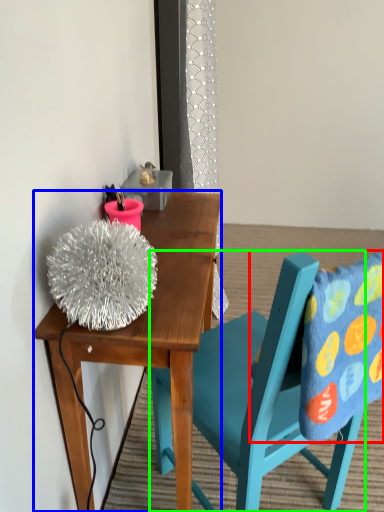
Question: Considering the real-world distances, which object is farthest from pillow (highlighted by a red box)? desk (highlighted by a blue box) or chair (highlighted by a green box)?

Choices:
 (A) desk
 (B) chair

Answer: (A)